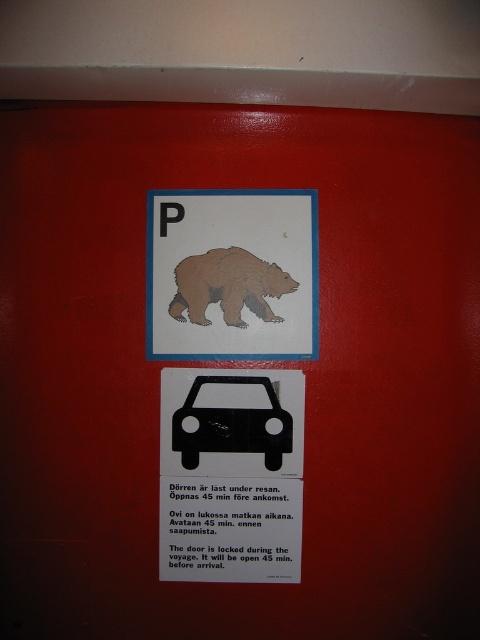
Based on the scene description, where is the brown cardboard bear at center located in terms of coordinates?

The brown cardboard bear at center is located at coordinates point (228, 285).

You are standing in front of the two signs on the red wall. You want to touch the cardboard bear at upper center. Can you reach it without moving your feet?

The cardboard bear at upper center is 3.63 feet away from viewer. Since it is within arm reach, you can touch it without moving your feet.